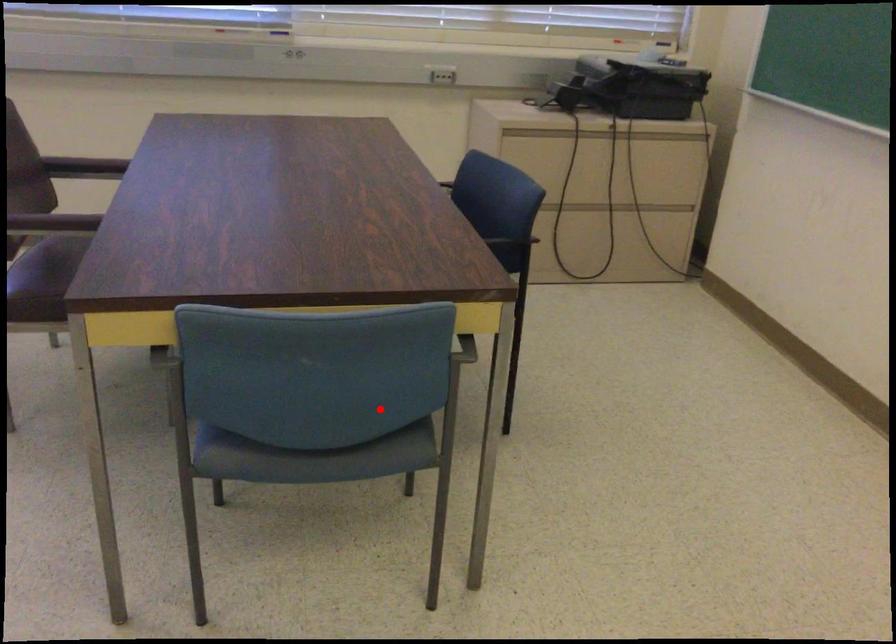
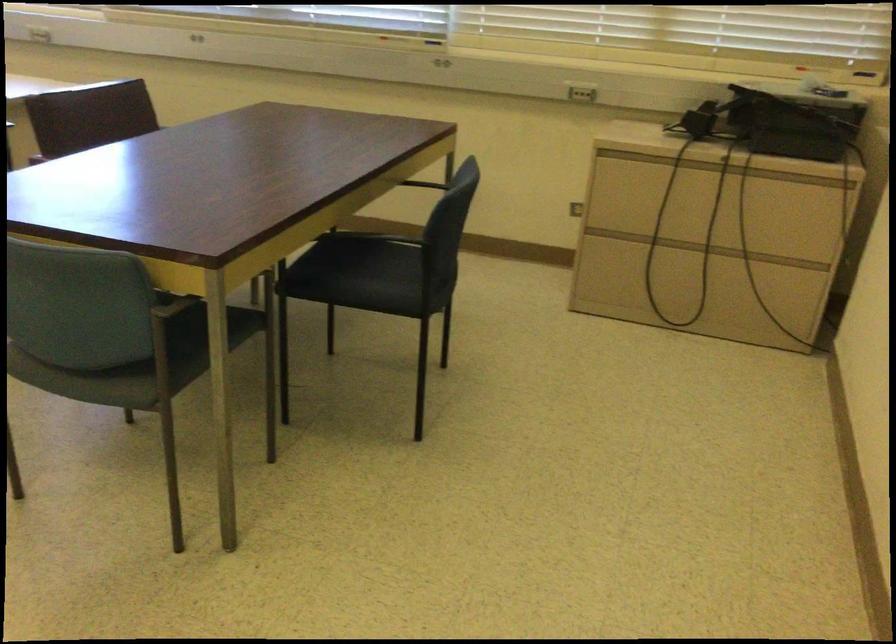
Locate, in the second image, the point that corresponds to the highlighted location in the first image.

(173, 359)